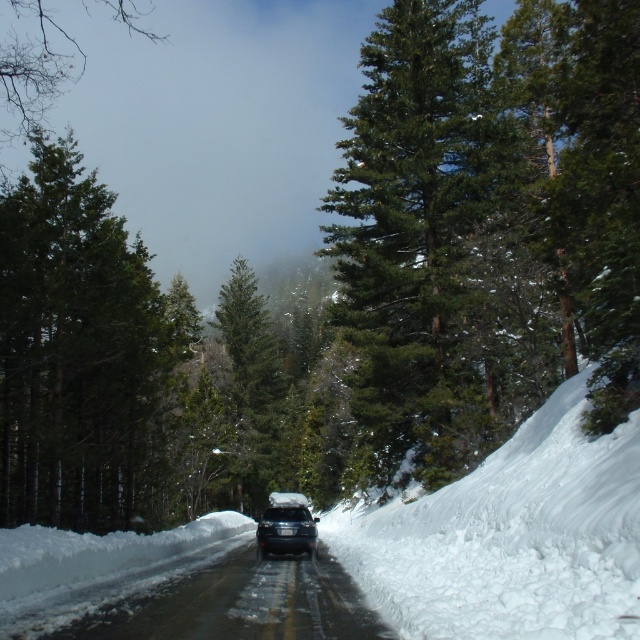
Does black asphalt road at center have a larger size compared to green matte tree at upper left?

No.

Locate an element on the screen. This screenshot has width=640, height=640. black asphalt road at center is located at coordinates (173, 586).

Where is `black asphalt road at center`? This screenshot has height=640, width=640. black asphalt road at center is located at coordinates (173, 586).

Who is more distant from viewer, (163, 618) or (250, 330)?

Positioned behind is point (250, 330).

Which is above, black asphalt road at center or green matte tree at center?

green matte tree at center is above.

Which is in front, point (228, 616) or point (250, 496)?

Point (228, 616) is more forward.

Identify the location of black asphalt road at center. (173, 586).

Can you confirm if green textured tree at left is taller than satin black suv at center?

Indeed, green textured tree at left has a greater height compared to satin black suv at center.

The height and width of the screenshot is (640, 640). Identify the location of green textured tree at left. (83, 355).